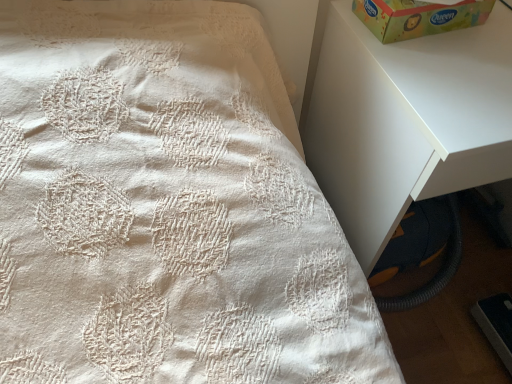
Locate an element on the screen. The width and height of the screenshot is (512, 384). vacant space in front of green paperboard box at upper right is located at coordinates (428, 76).